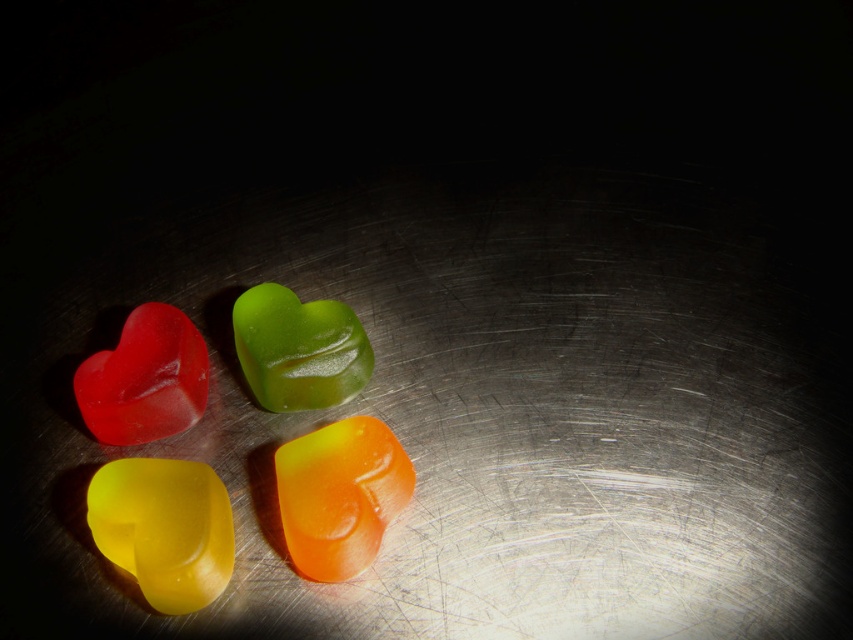
Question: Among these points, which one is nearest to the camera?

Choices:
 (A) (173, 401)
 (B) (245, 348)

Answer: (A)

Question: Which point is farther to the camera?

Choices:
 (A) translucent yellow heart at lower left
 (B) matte translucent heart at upper left
 (C) translucent orange heart at center

Answer: (B)

Question: Observing the image, what is the correct spatial positioning of translucent orange heart at center in reference to green translucent heart at center?

Choices:
 (A) left
 (B) right

Answer: (B)

Question: Considering the real-world distances, which object is farthest from the translucent yellow heart at lower left?

Choices:
 (A) matte translucent heart at upper left
 (B) translucent orange heart at center
 (C) green translucent heart at center

Answer: (C)

Question: Is translucent orange heart at center smaller than matte translucent heart at upper left?

Choices:
 (A) no
 (B) yes

Answer: (A)

Question: Where is translucent yellow heart at lower left located in relation to matte translucent heart at upper left in the image?

Choices:
 (A) left
 (B) right

Answer: (B)